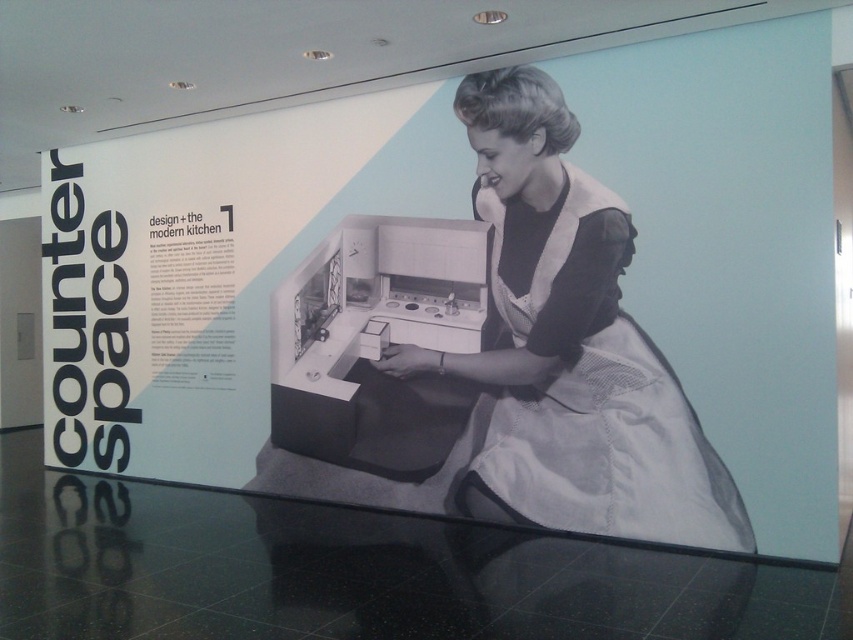
Question: Based on their relative distances, which object is farther from the transparent glass table at lower center?

Choices:
 (A) metallic stove at center
 (B) black fabric apron at center

Answer: (A)

Question: Can you confirm if transparent glass table at lower center is positioned above black fabric apron at center?

Choices:
 (A) yes
 (B) no

Answer: (B)

Question: Can you confirm if black fabric apron at center is wider than metallic stove at center?

Choices:
 (A) no
 (B) yes

Answer: (B)

Question: Does transparent glass table at lower center have a greater width compared to metallic stove at center?

Choices:
 (A) no
 (B) yes

Answer: (B)

Question: Considering the real-world distances, which object is farthest from the transparent glass table at lower center?

Choices:
 (A) black fabric apron at center
 (B) metallic stove at center

Answer: (B)

Question: Which of the following is the farthest from the observer?

Choices:
 (A) transparent glass table at lower center
 (B) black fabric apron at center
 (C) metallic stove at center

Answer: (C)